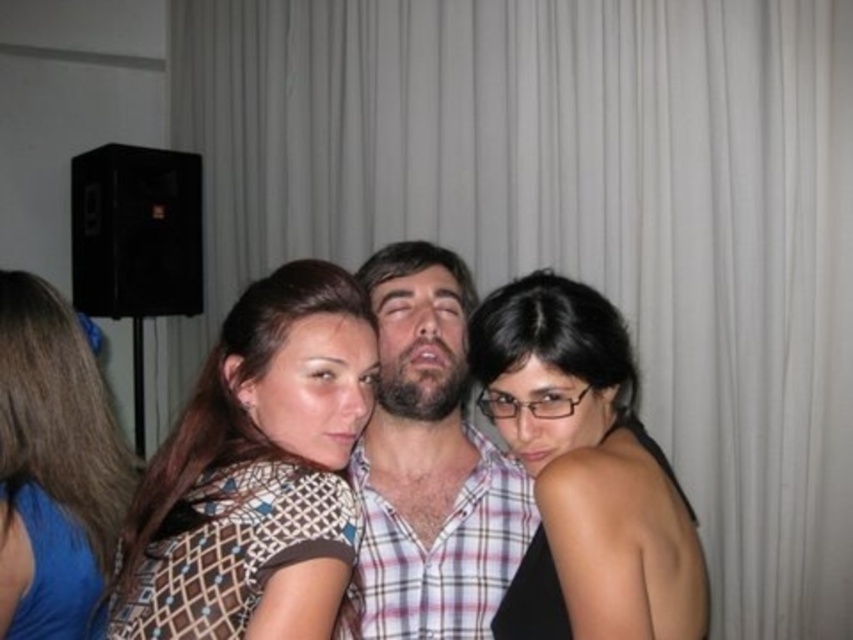
You are at a party and want to hand a drink to the person wearing the matte brown dress at left. Since the plaid fabric shirt at center is blocking your view, can you still reach them without moving around the obstruction?

The plaid fabric shirt at center is in front of the matte brown dress at left, so you cannot directly reach them without moving around the obstruction.

You are organizing a clothing display and need to arrange the patterned fabric shirt at center and the plaid fabric shirt at center on a rack. Given that the rack has limited space, which shirt should you place first to ensure both fit?

The patterned fabric shirt at center occupies less space than the plaid fabric shirt at center, so you should place the plaid fabric shirt at center first to ensure both fit on the rack.